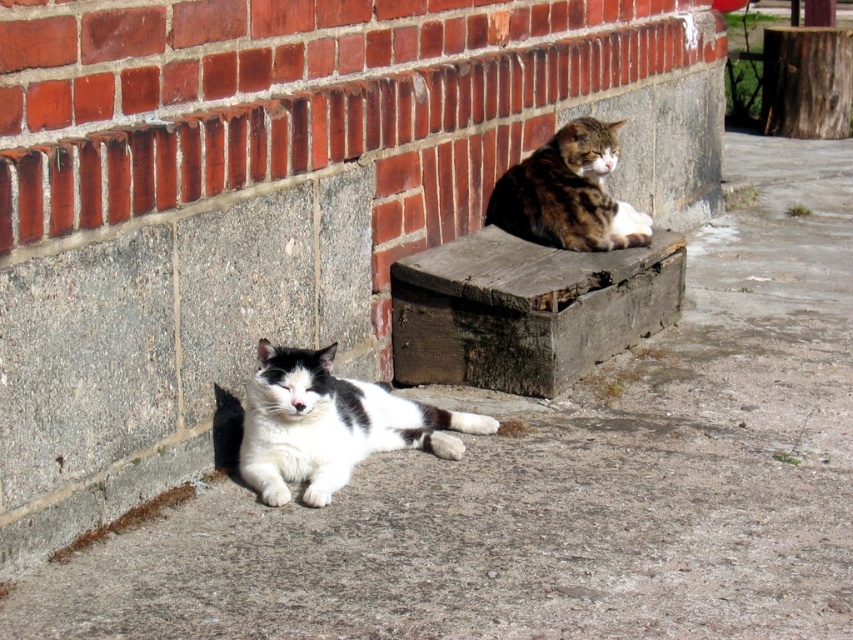
Which is below, white soft fur cat at lower left or tabby fur cat at upper center?

white soft fur cat at lower left is below.

Between white soft fur cat at lower left and tabby fur cat at upper center, which one has more height?

tabby fur cat at upper center

Find the location of a particular element. The image size is (853, 640). white soft fur cat at lower left is located at coordinates (329, 424).

Who is taller, weathered wood bench at upper center or tabby fur cat at upper center?

weathered wood bench at upper center is taller.

Is weathered wood bench at upper center positioned at the back of tabby fur cat at upper center?

No, weathered wood bench at upper center is in front of tabby fur cat at upper center.

Does point (656, 257) lie in front of point (544, 164)?

Yes, point (656, 257) is closer to viewer.

The image size is (853, 640). I want to click on weathered wood bench at upper center, so click(x=526, y=308).

How much distance is there between weathered wood bench at upper center and white soft fur cat at lower left?

26.63 inches

Is weathered wood bench at upper center further to camera compared to white soft fur cat at lower left?

Answer: Yes, it is.

Which is in front, point (653, 301) or point (247, 456)?

Point (247, 456) is in front.

Where is `weathered wood bench at upper center`? The image size is (853, 640). weathered wood bench at upper center is located at coordinates (526, 308).